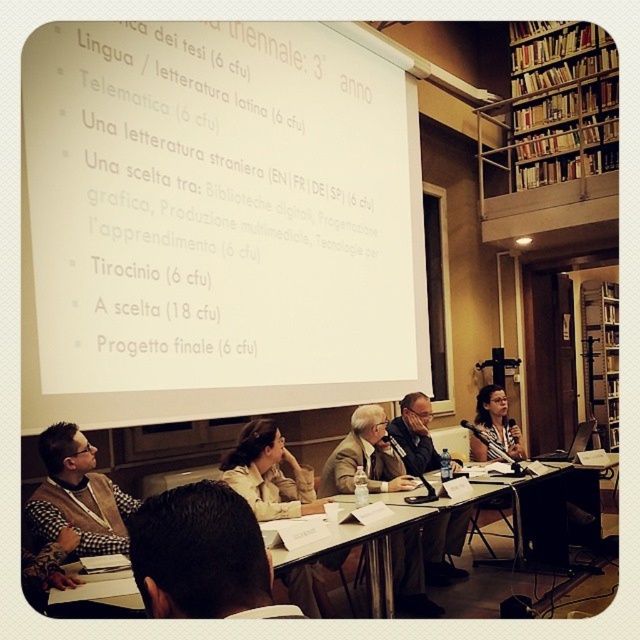
Question: Which of these objects is positioned closest to the white matte projection screen at upper center?

Choices:
 (A) brown leather jacket at lower center
 (B) checkered fabric vest at lower left
 (C) light brown leather jacket at center
 (D) matte black shirt at lower right

Answer: (B)

Question: Which point appears closest to the camera in this image?

Choices:
 (A) (273, 563)
 (B) (500, 403)
 (C) (86, 136)
 (D) (596, 333)

Answer: (A)

Question: Considering the relative positions of checkered fabric vest at lower left and matte brown jacket at center in the image provided, where is checkered fabric vest at lower left located with respect to matte brown jacket at center?

Choices:
 (A) below
 (B) above

Answer: (B)

Question: Which of these objects is positioned farthest from the wooden bookshelf at right?

Choices:
 (A) matte black shirt at lower right
 (B) brown leather jacket at lower center

Answer: (B)

Question: In this image, where is brown leather jacket at lower center located relative to light brown leather jacket at center?

Choices:
 (A) left
 (B) right

Answer: (A)

Question: Does wooden bookshelf at upper right lie behind wooden bookshelf at right?

Choices:
 (A) no
 (B) yes

Answer: (A)